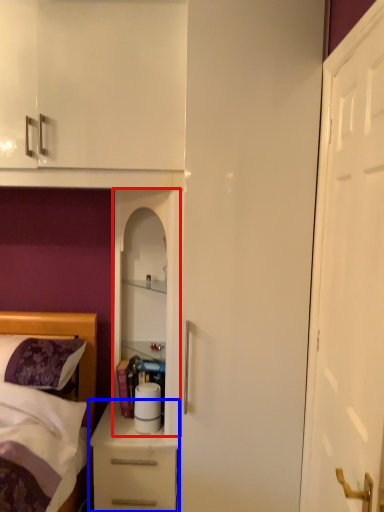
Question: Which of the following is the closest to the observer, cabinetry (highlighted by a red box) or chest of drawers (highlighted by a blue box)?

Choices:
 (A) cabinetry
 (B) chest of drawers

Answer: (A)